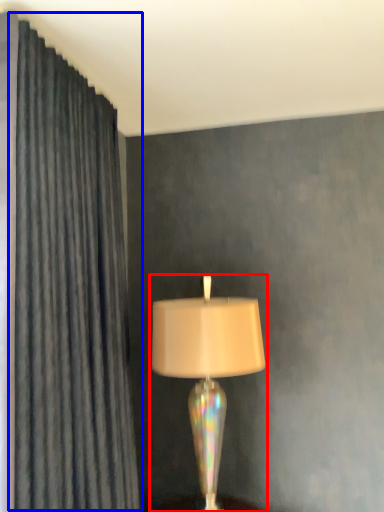
Question: Which point is further to the camera, lamp (highlighted by a red box) or curtain (highlighted by a blue box)?

Choices:
 (A) lamp
 (B) curtain

Answer: (A)